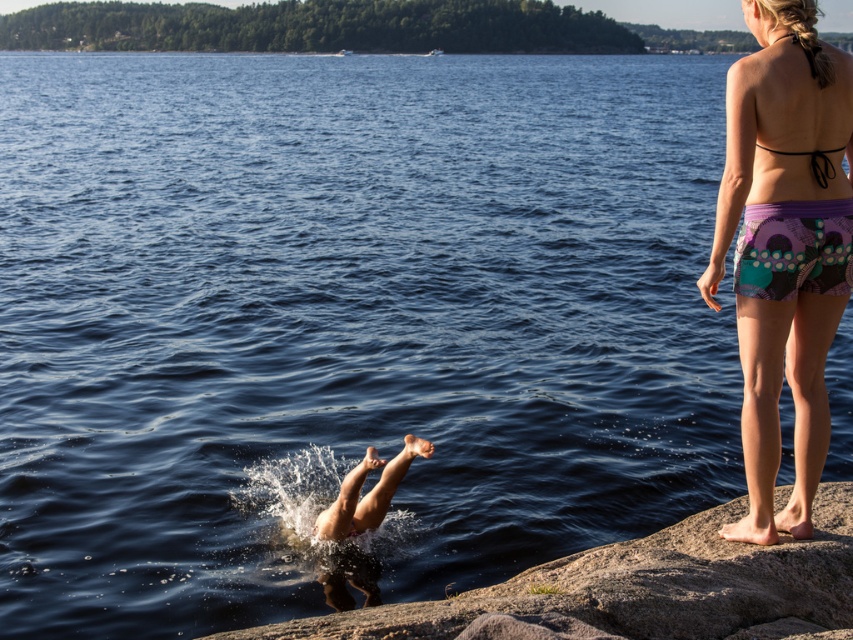
You are a photographer aiming to capture the smooth skin person at center and the gray granite rock at lower center in the same frame. Based on their positions, will the rock appear closer to the camera than the person?

The gray granite rock at lower center is in front of the smooth skin person at center, so yes, the rock will appear closer to the camera than the person.

You are a photographer trying to capture the diver in the water. You notice the purple printed shorts at right and the smooth skin person at center. Which object is covering part of the diver?

The purple printed shorts at right is positioned over smooth skin person at center, so the purple printed shorts at right is covering part of the diver.

You are standing at the edge of the water and want to jump into the lake. The gray granite rock at lower center is in your way. Can you safely step around it to reach the open water area? Please provide your reasoning.

The gray granite rock at lower center is 3.49 meters away from you. Since this distance allows enough space to maneuver around the rock, you can safely step around it to reach the open water area.